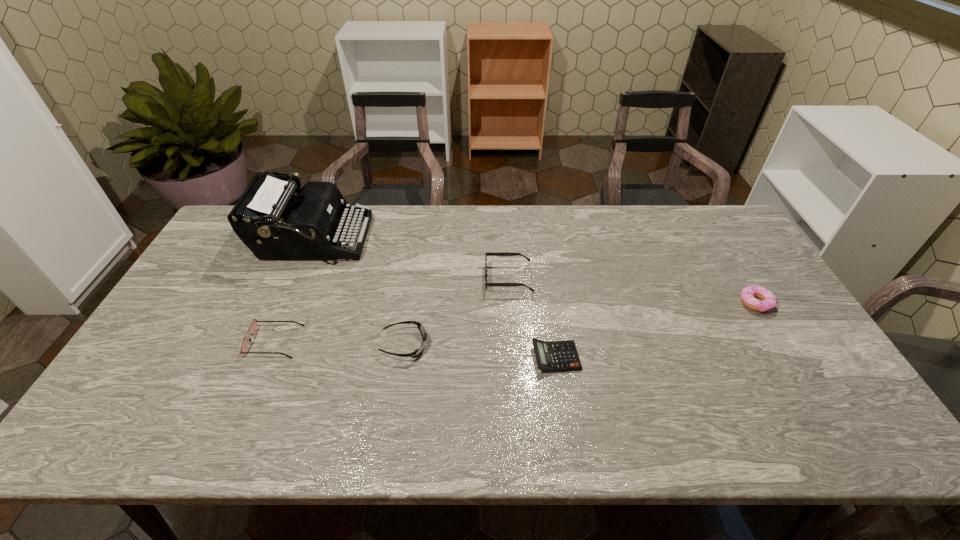
Locate an element on the screen. vacant space that satisfies the following two spatial constraints: 1. on the typing side of the tallest object; 2. on the back side of the shortest object is located at coordinates (262, 357).

Locate an element on the screen. The height and width of the screenshot is (540, 960). vacant space that satisfies the following two spatial constraints: 1. on the typing side of the typewriter; 2. on the back side of the calculator is located at coordinates (262, 357).

Where is `blank space that satisfies the following two spatial constraints: 1. on the typing side of the calculator; 2. on the left side of the typewriter`? This screenshot has width=960, height=540. blank space that satisfies the following two spatial constraints: 1. on the typing side of the calculator; 2. on the left side of the typewriter is located at coordinates (262, 357).

Find the location of a particular element. free location that satisfies the following two spatial constraints: 1. on the lenses of the calculator; 2. on the right side of the shortest sunglasses is located at coordinates tap(402, 357).

Identify the location of blank space that satisfies the following two spatial constraints: 1. on the bridge of the leftmost sunglasses; 2. on the right side of the calculator. (268, 357).

The image size is (960, 540). In order to click on vacant point that satisfies the following two spatial constraints: 1. on the typing side of the tallest object; 2. on the back side of the rightmost object in this screenshot , I will do `click(286, 303)`.